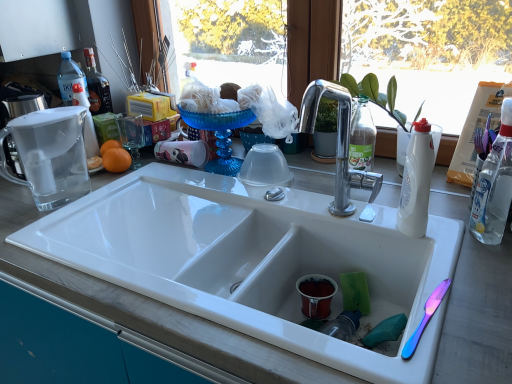
Where is `free space in front of orangesmoothfruit at left`? Image resolution: width=512 pixels, height=384 pixels. free space in front of orangesmoothfruit at left is located at coordinates (115, 203).